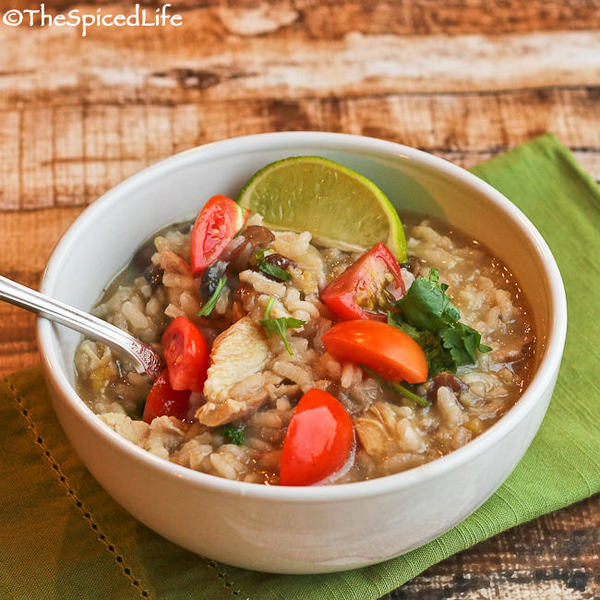
Identify the location of bowl. This screenshot has height=600, width=600. (448, 502).